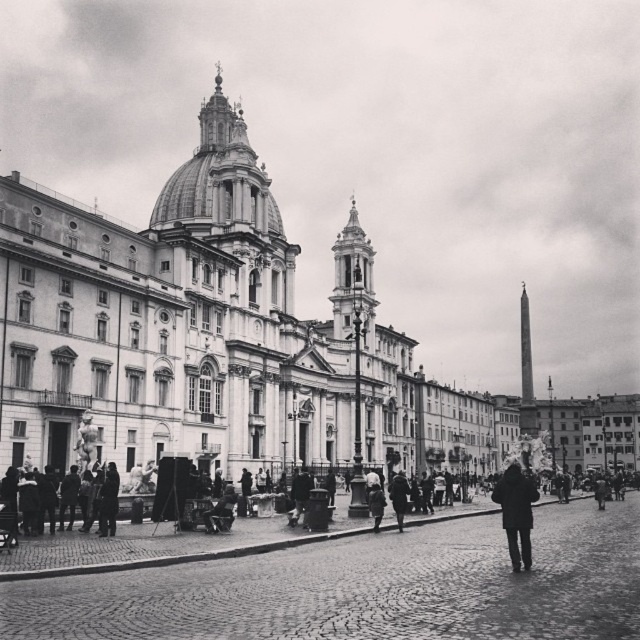
Is dark gray coat at lower right bigger than dark gray coat at center?

Indeed, dark gray coat at lower right has a larger size compared to dark gray coat at center.

Based on the photo, which of these two, dark gray coat at lower right or dark gray coat at center, stands shorter?

dark gray coat at center

Describe the element at coordinates (397, 497) in the screenshot. The width and height of the screenshot is (640, 640). I see `dark gray coat at lower right` at that location.

You are a GUI agent. You are given a task and a screenshot of the screen. Output one action in this format:
    pyautogui.click(x=<x>, y=<y>)
    Task: Click on the dark gray coat at lower right
    The height and width of the screenshot is (640, 640).
    Given the screenshot: What is the action you would take?
    pyautogui.click(x=397, y=497)

Between white marble palace at center and dark gray coat at lower right, which one is positioned higher?

white marble palace at center is above.

Is white marble palace at center to the right of dark gray coat at lower right from the viewer's perspective?

Indeed, white marble palace at center is positioned on the right side of dark gray coat at lower right.

Identify the location of white marble palace at center. (209, 336).

Is smooth cobblestone street at center closer to camera compared to dark gray coat at center?

That is True.

Is point (76, 600) positioned in front of point (371, 502)?

Yes, it is.

Is point (214, 589) closer to viewer compared to point (381, 500)?

Yes, it is.

I want to click on smooth cobblestone street at center, so click(x=365, y=588).